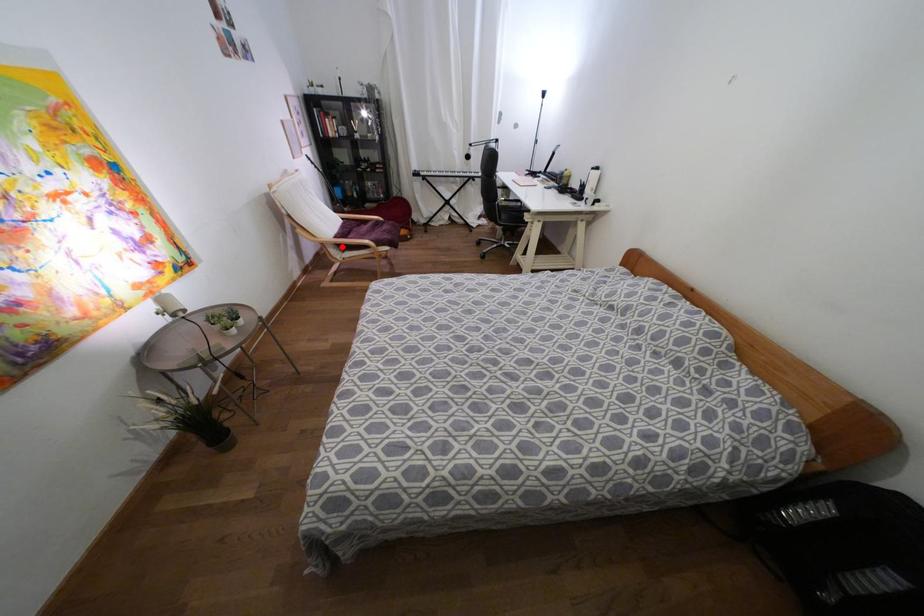
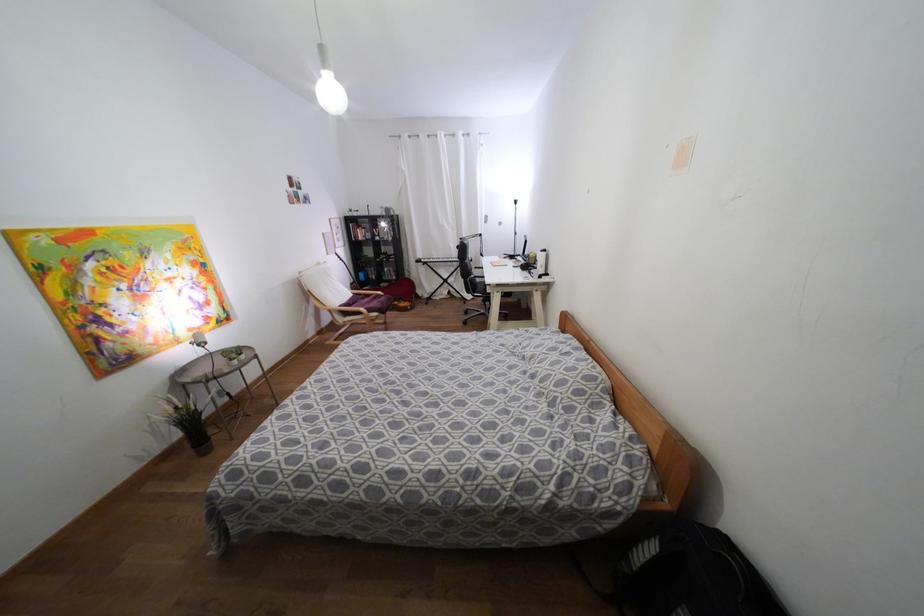
Find the pixel in the second image that matches the highlighted location in the first image.

(344, 313)